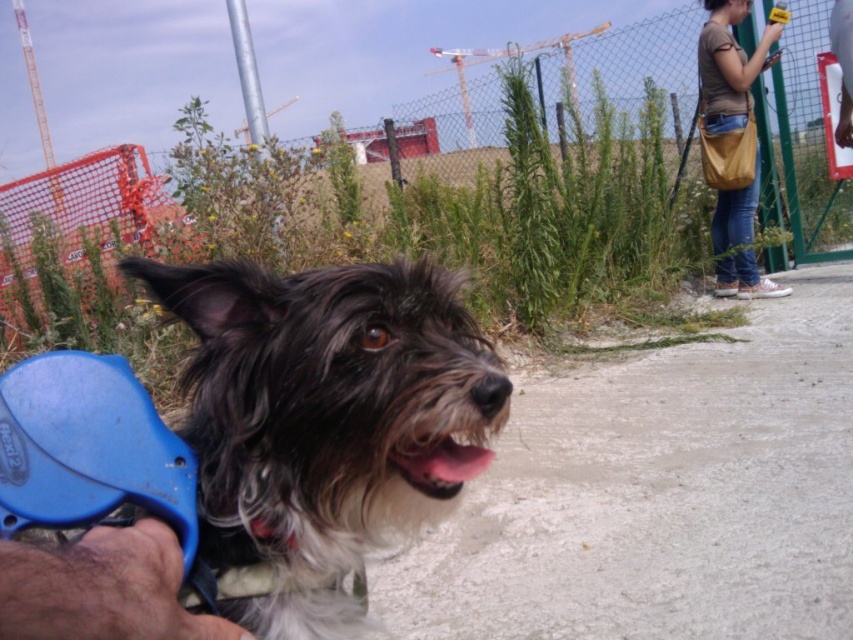
Who is positioned more to the right, metal mesh fence at center or fuzzy fur dog at center?

fuzzy fur dog at center

Does metal mesh fence at center have a greater width compared to fuzzy fur dog at center?

Yes, metal mesh fence at center is wider than fuzzy fur dog at center.

Which is behind, point (801, 32) or point (154, 634)?

The point (801, 32) is more distant.

At what (x,y) coordinates should I click in order to perform the action: click on metal mesh fence at center. Please return your answer as a coordinate pair (x, y). Image resolution: width=853 pixels, height=640 pixels. Looking at the image, I should click on (x=131, y=67).

Measure the distance from fuzzy black dog at center to metal mesh fence at center.

A distance of 6.09 meters exists between fuzzy black dog at center and metal mesh fence at center.

Does point (213, 524) come behind point (798, 32)?

No, (213, 524) is in front of (798, 32).

Identify the location of fuzzy black dog at center. (325, 420).

Who is positioned more to the left, fuzzy fur dog at center or denim jeans at right?

fuzzy fur dog at center

Between fuzzy fur dog at center and denim jeans at right, which one has less height?

fuzzy fur dog at center

Describe the element at coordinates (102, 588) in the screenshot. This screenshot has height=640, width=853. I see `fuzzy fur dog at center` at that location.

In order to click on fuzzy fur dog at center in this screenshot , I will do `click(102, 588)`.